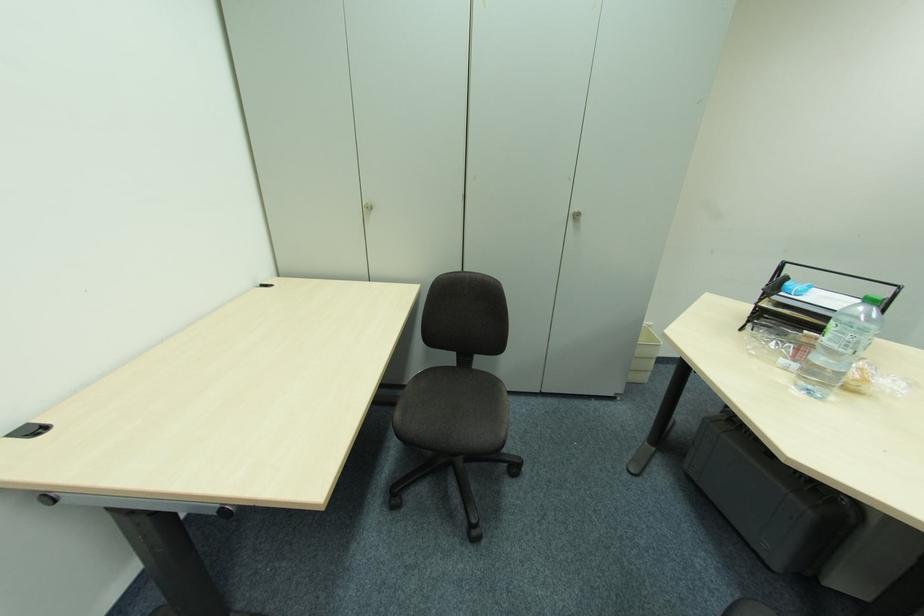
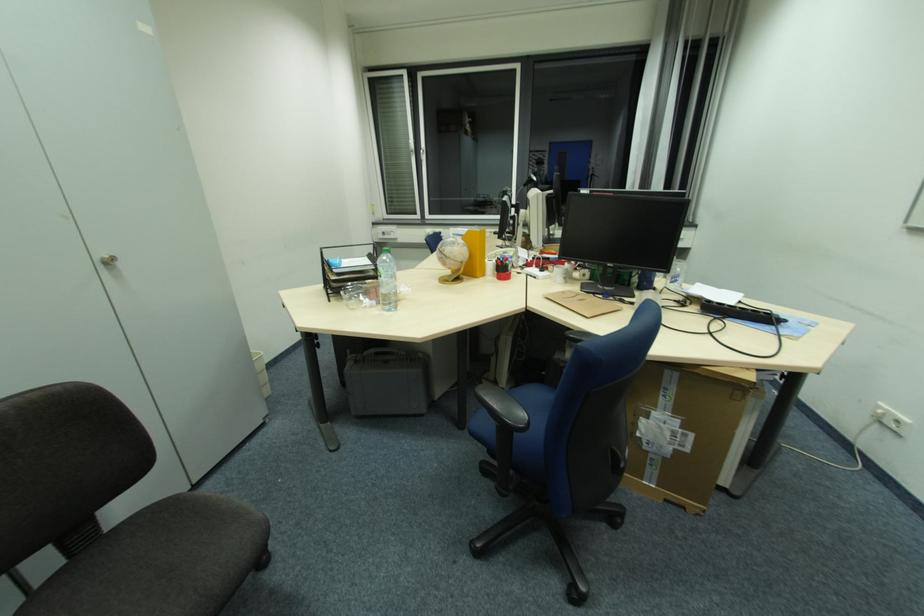
The first image is from the beginning of the video and the second image is from the end. How did the camera likely rotate when shooting the video?

The rotation direction of the camera is right-down.